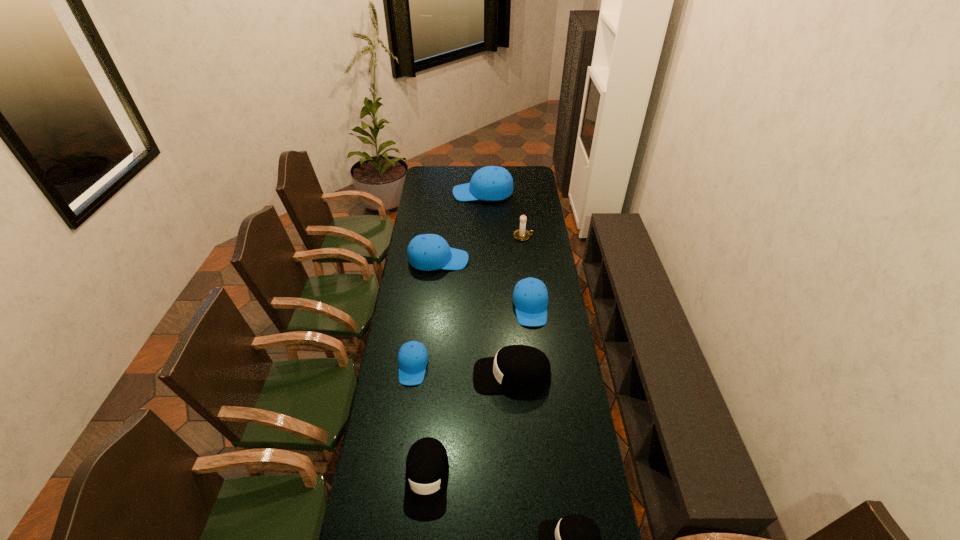
I want to click on free space located on the front-facing side of the smallest blue cap, so click(406, 418).

Find the location of a particular element. object that is at the far edge is located at coordinates (491, 183).

The image size is (960, 540). In order to click on candle holder that is at the right edge in this screenshot , I will do `click(521, 234)`.

Locate an element on the screen. The image size is (960, 540). vacant space at the far edge of the desktop is located at coordinates (513, 182).

In the image, there is a desktop. Identify the location of vacant space at the left edge. The height and width of the screenshot is (540, 960). (364, 502).

This screenshot has width=960, height=540. I want to click on blank space at the right edge of the desktop, so click(x=550, y=464).

Locate an element on the screen. The width and height of the screenshot is (960, 540). free point at the far right corner is located at coordinates (536, 170).

Identify the location of free point between the leftmost black cap and the farthest black cap. The width and height of the screenshot is (960, 540). (469, 427).

Locate an element on the screen. unoccupied position between the smallest blue cap and the second smallest blue cap is located at coordinates (471, 337).

You are a GUI agent. You are given a task and a screenshot of the screen. Output one action in this format:
    pyautogui.click(x=<x>, y=<y>)
    Task: Click on the blank region between the third smallest blue cap and the third biggest blue cap
    Image resolution: width=960 pixels, height=540 pixels.
    Given the screenshot: What is the action you would take?
    pyautogui.click(x=485, y=284)